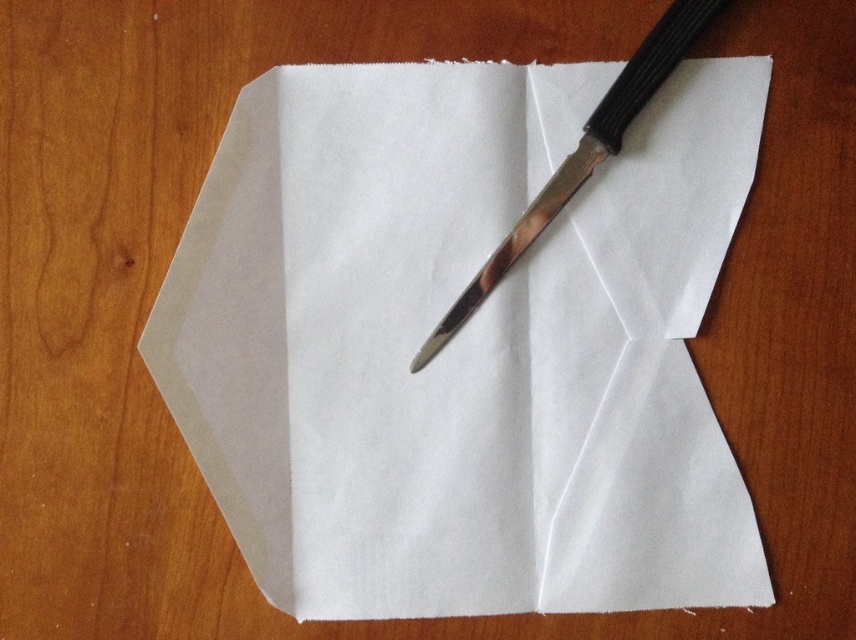
You need to cut along the folded edge of the white matte paper at center. The polished metal knife at center is currently resting on top. Is the knife in a suitable position to start cutting immediately?

The white matte paper at center is positioned under the polished metal knife at center, so the knife is already resting on top of the paper. This means the knife is in a suitable position to start cutting immediately as it is already placed over the paper.

You are an artist trying to cut a piece of paper. You have a white matte paper at center and a polished metal knife at center. Which object should you use to cut the paper?

The polished metal knife at center should be used to cut the paper, as it is a cutting tool, while the white matte paper at center is the material to be cut.